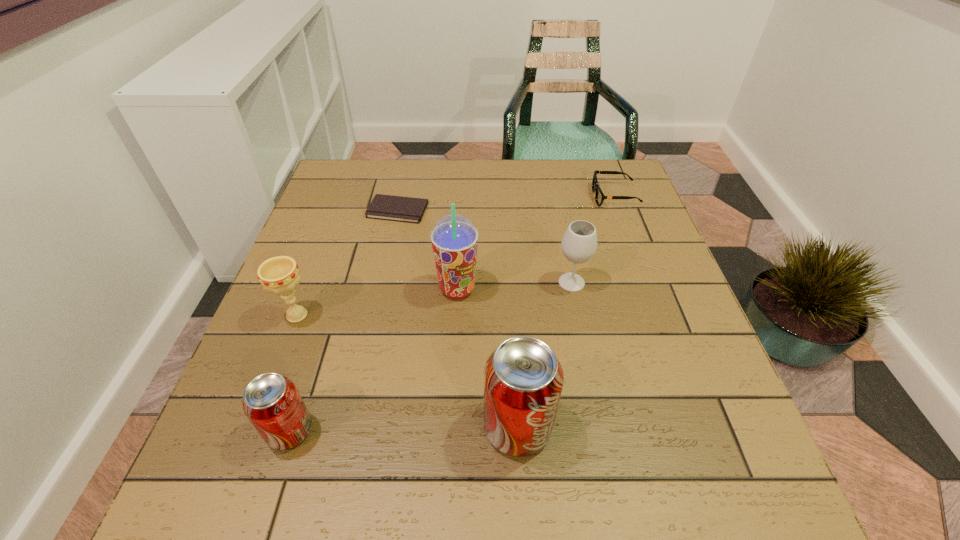
The image size is (960, 540). Identify the location of blank space at the right edge of the desktop. (660, 249).

This screenshot has height=540, width=960. I want to click on vacant area at the far left corner of the desktop, so click(372, 199).

This screenshot has height=540, width=960. In order to click on free region at the far right corner of the desktop in this screenshot , I will do `click(625, 174)`.

Locate an element on the screen. The image size is (960, 540). vacant area at the near right corner is located at coordinates (693, 412).

You are a GUI agent. You are given a task and a screenshot of the screen. Output one action in this format:
    pyautogui.click(x=<x>, y=<y>)
    Task: Click on the empty location between the left soda can and the fourth object from right to left
    This screenshot has height=540, width=960.
    Given the screenshot: What is the action you would take?
    pyautogui.click(x=373, y=360)

Identify the location of empty space between the fifth object from left to right and the checkbook. Image resolution: width=960 pixels, height=540 pixels. (458, 318).

The width and height of the screenshot is (960, 540). I want to click on vacant point located between the taller soda can and the shorter soda can, so click(403, 428).

Locate an element on the screen. The image size is (960, 540). vacant area that lies between the right soda can and the shortest object is located at coordinates (458, 318).

The width and height of the screenshot is (960, 540). Find the location of `empty location between the fourth object from left to right and the sixth object from left to right`. empty location between the fourth object from left to right and the sixth object from left to right is located at coordinates (515, 286).

The image size is (960, 540). Identify the location of unoccupied area between the left soda can and the chalice. (294, 373).